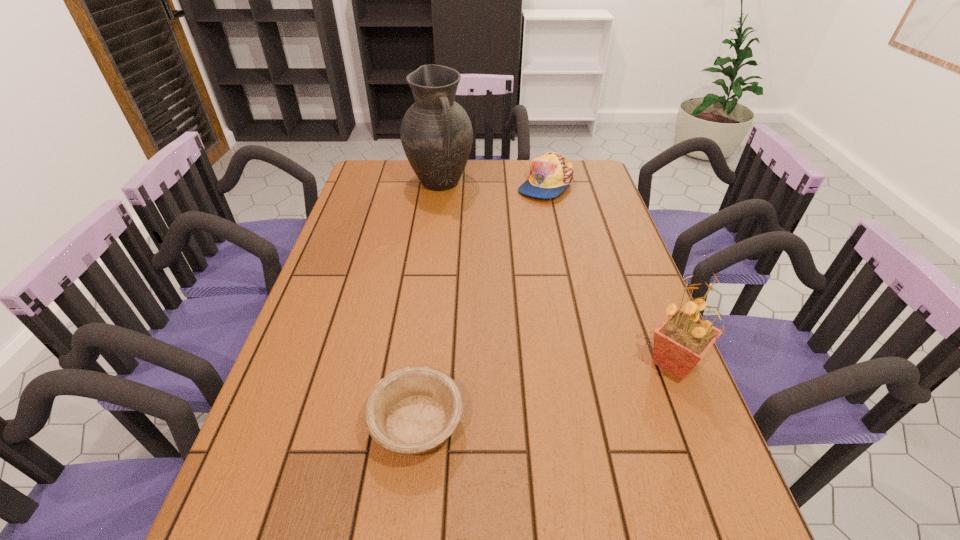
The width and height of the screenshot is (960, 540). Find the location of `vacant space on the desktop that is between the bowl and the sunflower and is positioned on the side of the pitcher with the handle`. vacant space on the desktop that is between the bowl and the sunflower and is positioned on the side of the pitcher with the handle is located at coordinates (568, 387).

Where is `vacant space on the desktop that is between the shortest object and the sunflower and is positioned on the bill of the third tallest object`? This screenshot has width=960, height=540. vacant space on the desktop that is between the shortest object and the sunflower and is positioned on the bill of the third tallest object is located at coordinates (570, 387).